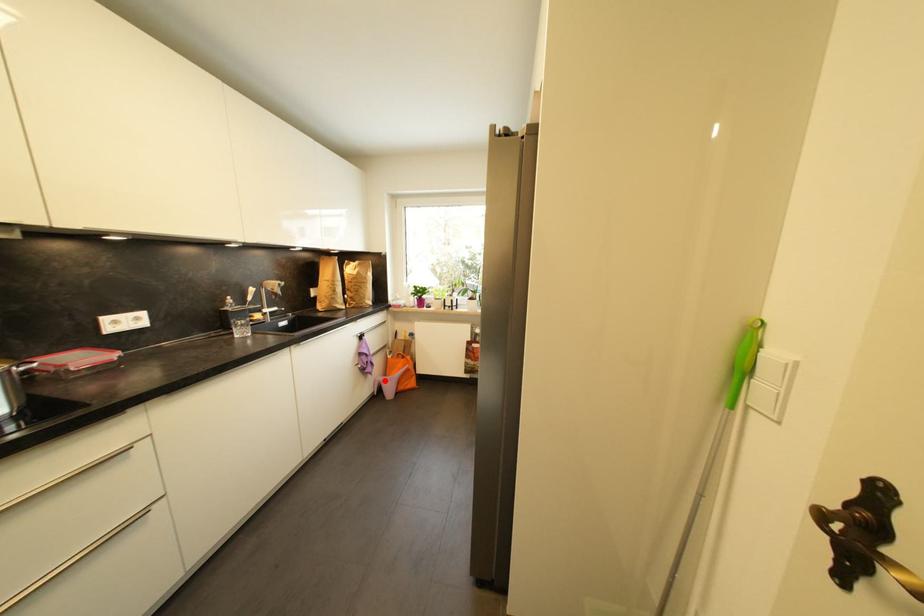
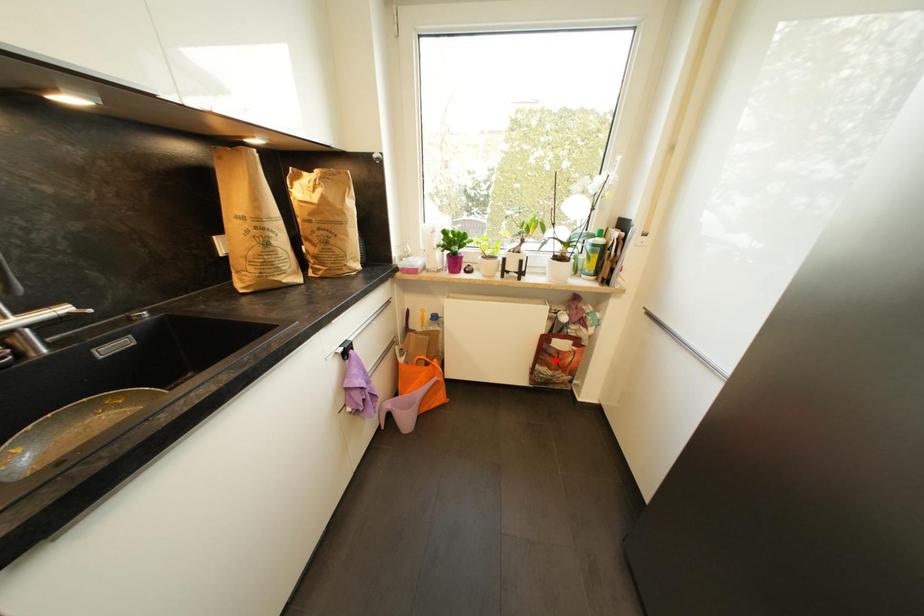
I am providing you with two images of the same scene from different viewpoints. A red point is marked on the first image and another point is marked on the second image. Are the points marked in image1 and image2 representing the same 3D position?

No